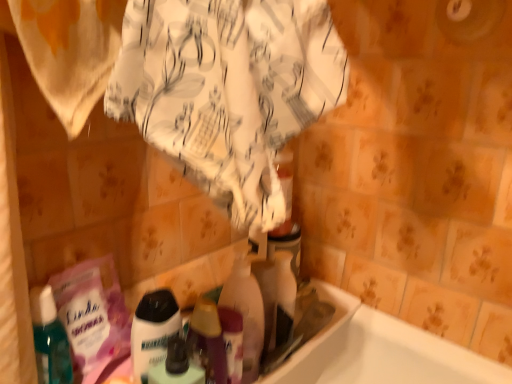
Question: Is translucent plastic bottle at center, the 1th cleaning product positioned from the right, outside of translucent plastic bottle at center, which is the 3th cleaning product in right-to-left order?

Choices:
 (A) yes
 (B) no

Answer: (A)

Question: Is translucent plastic bottle at center, the 1th cleaning product positioned from the right, behind translucent plastic bottle at center, which is the 3th cleaning product in right-to-left order?

Choices:
 (A) yes
 (B) no

Answer: (A)

Question: Could you tell me if translucent plastic bottle at center, the third cleaning product viewed from the left, is turned towards translucent plastic bottle at center, which is the 3th cleaning product in right-to-left order?

Choices:
 (A) no
 (B) yes

Answer: (A)

Question: Considering the relative positions of translucent plastic bottle at center, the third cleaning product viewed from the left, and translucent plastic bottle at center, the 1th cleaning product in the left-to-right sequence, in the image provided, is translucent plastic bottle at center, the third cleaning product viewed from the left, to the right of translucent plastic bottle at center, the 1th cleaning product in the left-to-right sequence, from the viewer's perspective?

Choices:
 (A) yes
 (B) no

Answer: (A)

Question: From a real-world perspective, is translucent plastic bottle at center, the third cleaning product viewed from the left, beneath translucent plastic bottle at center, the 1th cleaning product in the left-to-right sequence?

Choices:
 (A) no
 (B) yes

Answer: (B)

Question: Considering their positions, is translucent plastic bottle at center, the 1th cleaning product in the left-to-right sequence, located in front of or behind translucent plastic bottle at center, the third cleaning product viewed from the left?

Choices:
 (A) front
 (B) behind

Answer: (A)

Question: Considering the positions of point (174, 334) and point (254, 273), is point (174, 334) closer or farther from the camera than point (254, 273)?

Choices:
 (A) closer
 (B) farther

Answer: (A)

Question: In terms of size, does translucent plastic bottle at center, which is the 3th cleaning product in right-to-left order, appear bigger or smaller than translucent plastic bottle at center, the 1th cleaning product positioned from the right?

Choices:
 (A) big
 (B) small

Answer: (B)

Question: From a real-world perspective, is translucent plastic bottle at center, the 1th cleaning product in the left-to-right sequence, physically located above or below translucent plastic bottle at center, the 1th cleaning product positioned from the right?

Choices:
 (A) below
 (B) above

Answer: (B)

Question: Considering the positions of translucent plastic bottle at center, the 1th cleaning product positioned from the right, and translucent plastic bottle at center, arranged as the second cleaning product when viewed from the right, in the image, is translucent plastic bottle at center, the 1th cleaning product positioned from the right, taller or shorter than translucent plastic bottle at center, arranged as the second cleaning product when viewed from the right,?

Choices:
 (A) short
 (B) tall

Answer: (A)

Question: Choose the correct answer: Is translucent plastic bottle at center, the third cleaning product viewed from the left, inside translucent plastic bottle at center, arranged as the second cleaning product when viewed from the right, or outside it?

Choices:
 (A) outside
 (B) inside

Answer: (A)

Question: From a real-world perspective, is translucent plastic bottle at center, the 1th cleaning product positioned from the right, above or below translucent plastic bottle at center, which is counted as the second cleaning product, starting from the left?

Choices:
 (A) below
 (B) above

Answer: (A)

Question: In terms of size, does translucent plastic bottle at center, the third cleaning product viewed from the left, appear bigger or smaller than translucent plastic bottle at center, which is counted as the second cleaning product, starting from the left?

Choices:
 (A) big
 (B) small

Answer: (B)

Question: In terms of size, does translucent plastic bottle at center, the 1th cleaning product in the left-to-right sequence, appear bigger or smaller than translucent plastic bottle at center, arranged as the second cleaning product when viewed from the right?

Choices:
 (A) big
 (B) small

Answer: (B)

Question: From the image's perspective, is translucent plastic bottle at center, which is the 3th cleaning product in right-to-left order, positioned above or below translucent plastic bottle at center, which is counted as the second cleaning product, starting from the left?

Choices:
 (A) below
 (B) above

Answer: (A)